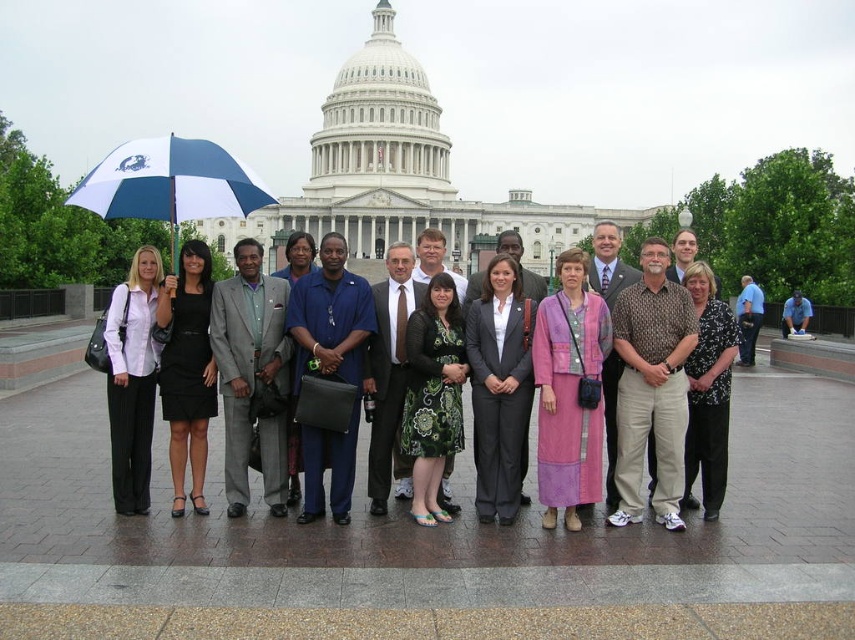
You are a photographer trying to capture a wide shot of the group and the Capitol building. The blue and white fabric umbrella at center is in the scene. Considering the umbrella is 66.06 meters away from the camera, will it appear small in the photograph?

The blue and white fabric umbrella at center is 66.06 meters from the camera, so it will appear small in the photograph.

You are a photographer trying to focus your camera on the subject in the middle of the group. Which item should you focus on first between the matte gray suit at center and the black floral blouse at center?

The matte gray suit at center is below the black floral blouse at center, so you should focus on the black floral blouse at center first because it is higher up and likely the main subject.

You are a photographer trying to capture a group photo of the pink fabric coat at center and the light gray suit at center. Based on their sizes, which one should you focus on first to ensure both are in frame?

The pink fabric coat at center is smaller than the light gray suit at center, so you should focus on the light gray suit at center first to ensure both are in frame.